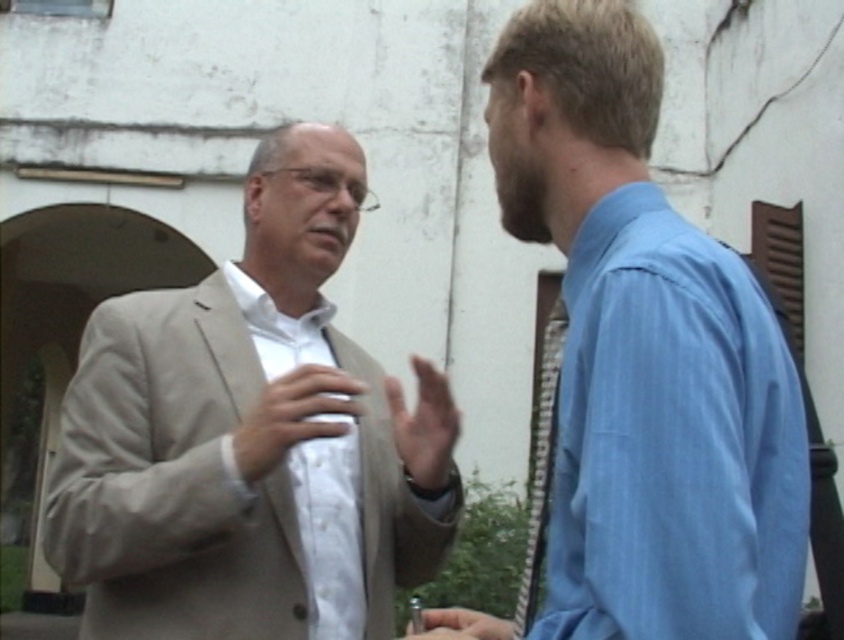
From the picture: Is light beige suit at center thinner than blue cotton shirt at right?

No.

Does light beige suit at center appear under blue cotton shirt at right?

Incorrect, light beige suit at center is not positioned below blue cotton shirt at right.

Does point (245, 387) come closer to viewer compared to point (625, 336)?

No, (245, 387) is behind (625, 336).

Image resolution: width=844 pixels, height=640 pixels. What are the coordinates of `light beige suit at center` in the screenshot? It's located at (252, 436).

Which is above, light beige suit at center or white smooth shirt at center?

light beige suit at center is above.

Which of these two, light beige suit at center or white smooth shirt at center, stands shorter?

white smooth shirt at center is shorter.

Between point (279, 500) and point (317, 529), which one is positioned behind?

The point (317, 529) is behind.

Identify the location of light beige suit at center. The image size is (844, 640). (252, 436).

Does point (675, 433) lie in front of point (223, 440)?

Yes, it is in front of point (223, 440).

Is blue cotton shirt at right taller than white smooth shirt at center?

Correct, blue cotton shirt at right is much taller as white smooth shirt at center.

Is point (594, 516) positioned before point (333, 440)?

Yes, it is in front of point (333, 440).

Image resolution: width=844 pixels, height=640 pixels. Find the location of `blue cotton shirt at right`. blue cotton shirt at right is located at coordinates (644, 355).